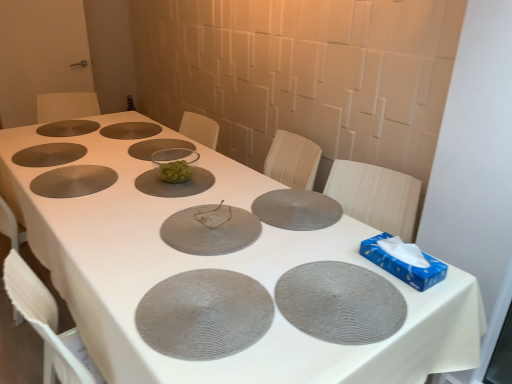
I want to click on free space above gray textured placemat at center, marked as the 1th glass plate in a front-to-back arrangement (from a real-world perspective), so click(x=201, y=297).